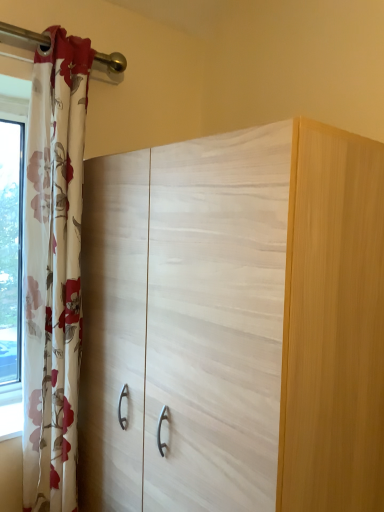
Where is `floral sheer curtain at left`? floral sheer curtain at left is located at coordinates (53, 271).

Describe the element at coordinates (53, 271) in the screenshot. Image resolution: width=384 pixels, height=512 pixels. I see `floral sheer curtain at left` at that location.

What do you see at coordinates (234, 324) in the screenshot? This screenshot has height=512, width=384. I see `white wood cupboard at center` at bounding box center [234, 324].

You are a GUI agent. You are given a task and a screenshot of the screen. Output one action in this format:
    pyautogui.click(x=<x>, y=<y>)
    Task: Click on the white wood cupboard at center
    
    Given the screenshot: What is the action you would take?
    [x=234, y=324]

Identify the location of floral sheer curtain at left. The width and height of the screenshot is (384, 512). (53, 271).

Between floral sheer curtain at left and white wood cupboard at center, which one appears on the left side from the viewer's perspective?

floral sheer curtain at left.

In the scene shown: Is floral sheer curtain at left further to camera compared to white wood cupboard at center?

Yes, floral sheer curtain at left is behind white wood cupboard at center.

Considering the positions of point (58, 426) and point (257, 210), is point (58, 426) closer or farther from the camera than point (257, 210)?

Point (58, 426) is farther from the camera than point (257, 210).

From the image's perspective, which object appears higher, floral sheer curtain at left or white wood cupboard at center?

floral sheer curtain at left.

From a real-world perspective, is floral sheer curtain at left physically located above or below white wood cupboard at center?

From a real-world perspective, floral sheer curtain at left is physically above white wood cupboard at center.

Considering the relative sizes of floral sheer curtain at left and white wood cupboard at center in the image provided, is floral sheer curtain at left wider than white wood cupboard at center?

No, floral sheer curtain at left is not wider than white wood cupboard at center.

Based on the photo, does floral sheer curtain at left have a lesser height compared to white wood cupboard at center?

No.

Looking at the image, does floral sheer curtain at left seem bigger or smaller compared to white wood cupboard at center?

Considering their sizes, floral sheer curtain at left takes up less space than white wood cupboard at center.

Would you say floral sheer curtain at left is inside or outside white wood cupboard at center?

floral sheer curtain at left is not enclosed by white wood cupboard at center.

In the scene shown: Is floral sheer curtain at left not near white wood cupboard at center?

No, floral sheer curtain at left is not far away from white wood cupboard at center.

Could you tell me if floral sheer curtain at left is turned towards white wood cupboard at center?

No, floral sheer curtain at left is not aimed at white wood cupboard at center.

What's the angular difference between floral sheer curtain at left and white wood cupboard at center's facing directions?

floral sheer curtain at left and white wood cupboard at center are facing 90 degrees away from each other.

How distant is floral sheer curtain at left from white wood cupboard at center?

floral sheer curtain at left is 15.90 inches away from white wood cupboard at center.

At what (x,y) coordinates should I click in order to perform the action: click on cupboard in front of the floral sheer curtain at left. Please return your answer as a coordinate pair (x, y). The image size is (384, 512). Looking at the image, I should click on coord(234,324).

Would you say white wood cupboard at center is to the left or to the right of floral sheer curtain at left in the picture?

Based on their positions, white wood cupboard at center is located to the right of floral sheer curtain at left.

Considering their positions, is white wood cupboard at center located in front of or behind floral sheer curtain at left?

Clearly, white wood cupboard at center is in front of floral sheer curtain at left.

Does point (261, 309) lie behind point (39, 341)?

No, (261, 309) is closer to viewer.

From the image's perspective, between white wood cupboard at center and floral sheer curtain at left, which one is located above?

From the image's view, floral sheer curtain at left is above.

From a real-world perspective, relative to floral sheer curtain at left, is white wood cupboard at center vertically above or below?

white wood cupboard at center is situated lower than floral sheer curtain at left in the real world.

Considering the relative sizes of white wood cupboard at center and floral sheer curtain at left in the image provided, is white wood cupboard at center thinner than floral sheer curtain at left?

No.

Is white wood cupboard at center taller than floral sheer curtain at left?

In fact, white wood cupboard at center may be shorter than floral sheer curtain at left.

Can you confirm if white wood cupboard at center is smaller than floral sheer curtain at left?

Actually, white wood cupboard at center might be larger than floral sheer curtain at left.

Is floral sheer curtain at left inside white wood cupboard at center?

No, floral sheer curtain at left is not inside white wood cupboard at center.

Is white wood cupboard at center not near floral sheer curtain at left?

white wood cupboard at center is actually quite close to floral sheer curtain at left.

Could you tell me if white wood cupboard at center is facing floral sheer curtain at left?

Yes.

Based on the photo, how far apart are white wood cupboard at center and floral sheer curtain at left?

white wood cupboard at center and floral sheer curtain at left are 15.90 inches apart from each other.

At what (x,y) coordinates should I click in order to perform the action: click on curtain on the left of white wood cupboard at center. Please return your answer as a coordinate pair (x, y). The height and width of the screenshot is (512, 384). Looking at the image, I should click on (53, 271).

The height and width of the screenshot is (512, 384). I want to click on cupboard that appears below the floral sheer curtain at left (from the image's perspective), so click(234, 324).

Where is `cupboard below the floral sheer curtain at left (from a real-world perspective)`? The image size is (384, 512). cupboard below the floral sheer curtain at left (from a real-world perspective) is located at coordinates (234, 324).